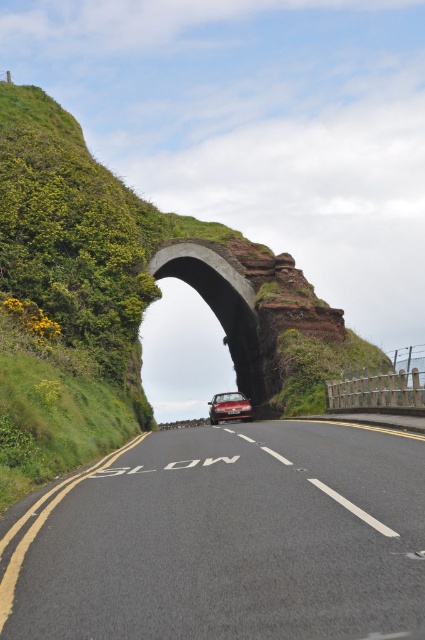
Question: Is concrete archway at center above shiny metallic car at center?

Choices:
 (A) yes
 (B) no

Answer: (A)

Question: Which point appears closest to the camera in this image?

Choices:
 (A) (53, 205)
 (B) (99, 480)

Answer: (B)

Question: Which object is the closest to the black asphalt road at center?

Choices:
 (A) concrete archway at center
 (B) shiny metallic car at center
 (C) green grassy hillside at upper left

Answer: (C)

Question: Does black asphalt road at center appear under concrete archway at center?

Choices:
 (A) no
 (B) yes

Answer: (B)

Question: Estimate the real-world distances between objects in this image. Which object is farther from the black asphalt road at center?

Choices:
 (A) green grassy hillside at upper left
 (B) shiny metallic car at center

Answer: (B)

Question: Is green grassy hillside at upper left further to the viewer compared to concrete archway at center?

Choices:
 (A) yes
 (B) no

Answer: (B)